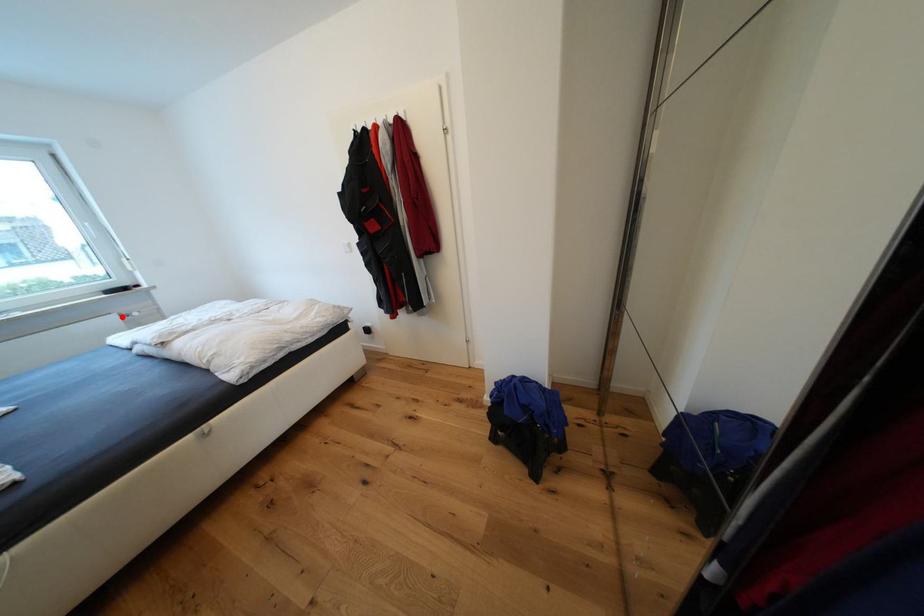
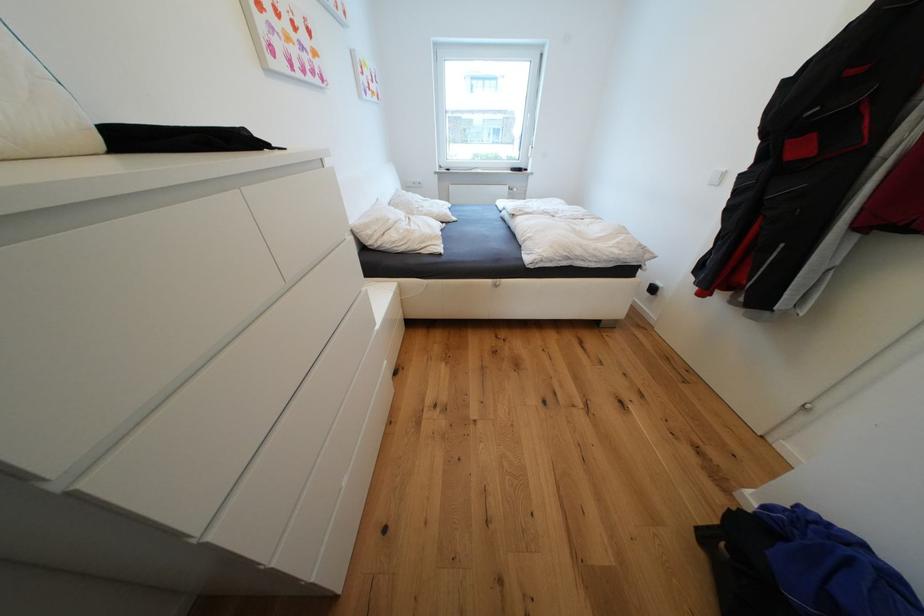
Question: I am providing you with two images of the same scene from different viewpoints. Image1 has a red point marked. In image2, the corresponding 3D location appears at what relative position? Reply with the corresponding letter.

Choices:
 (A) Closer
 (B) Farther

Answer: (A)